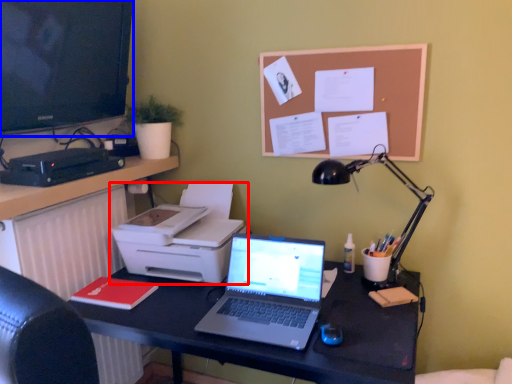
Question: Among these objects, which one is nearest to the camera, printer (highlighted by a red box) or television (highlighted by a blue box)?

Choices:
 (A) printer
 (B) television

Answer: (B)